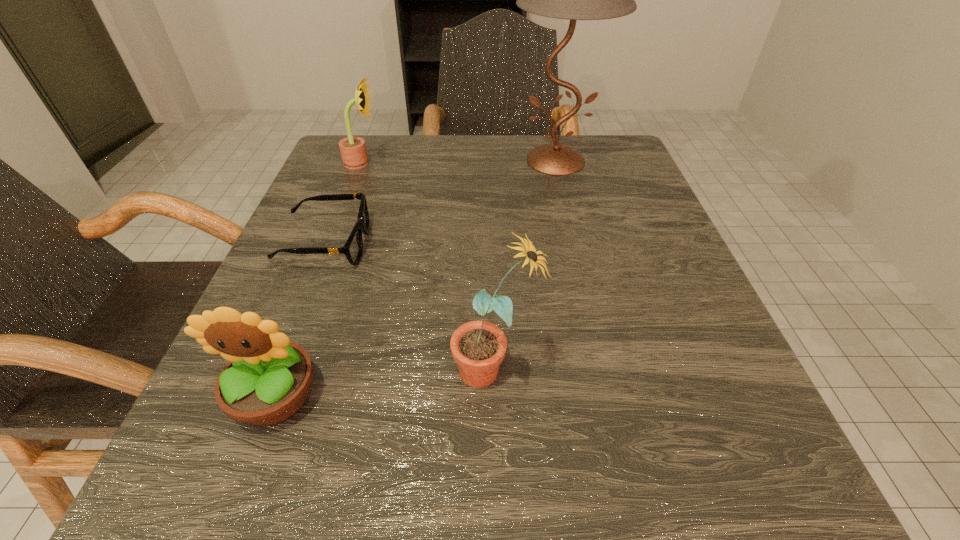
At what (x,y) coordinates should I click in order to perform the action: click on free space that satisfies the following two spatial constraints: 1. on the front-facing side of the tallest object; 2. on the face of the farthest sunflower. Please return your answer as a coordinate pair (x, y). Looking at the image, I should click on (556, 163).